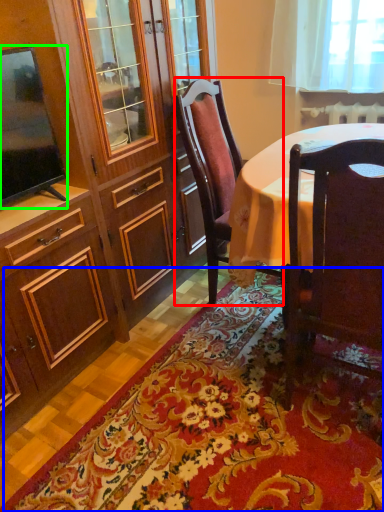
Question: Which object is positioned farthest from chair (highlighted by a red box)? Select from mat (highlighted by a blue box) and television (highlighted by a green box).

Choices:
 (A) mat
 (B) television

Answer: (A)